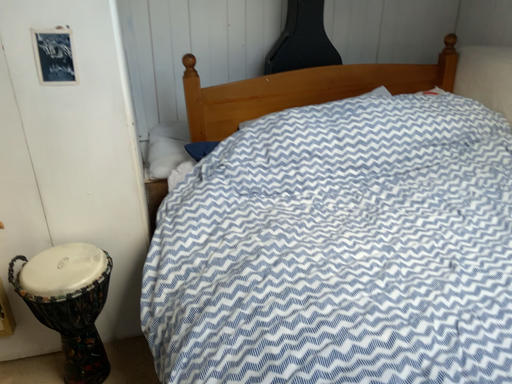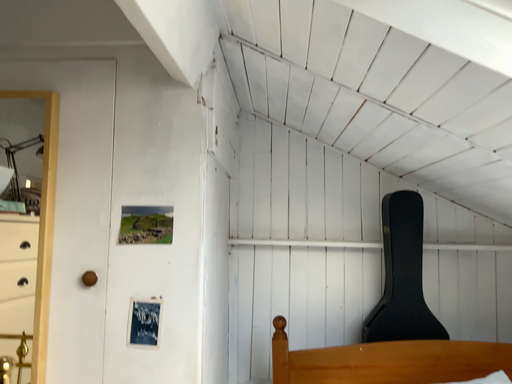
Question: Which way did the camera rotate in the video?

Choices:
 (A) rotated downward
 (B) rotated upward

Answer: (B)